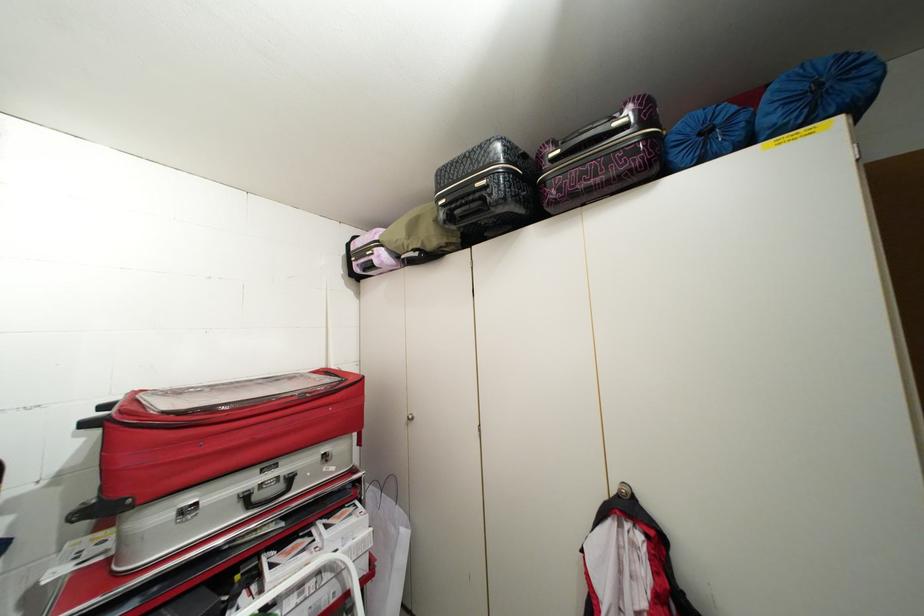
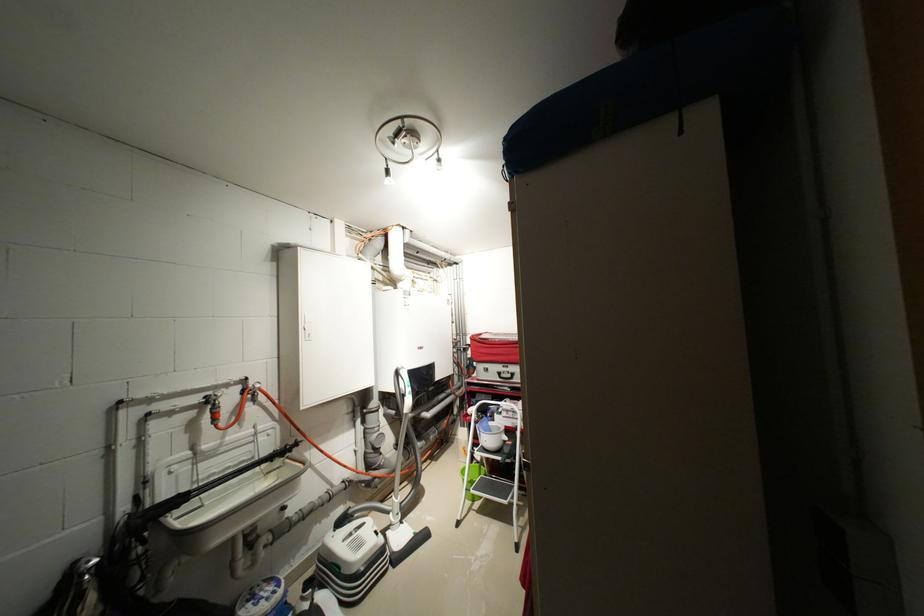
Find the pixel in the second image that matches (x=309, y=586) in the first image.

(515, 411)